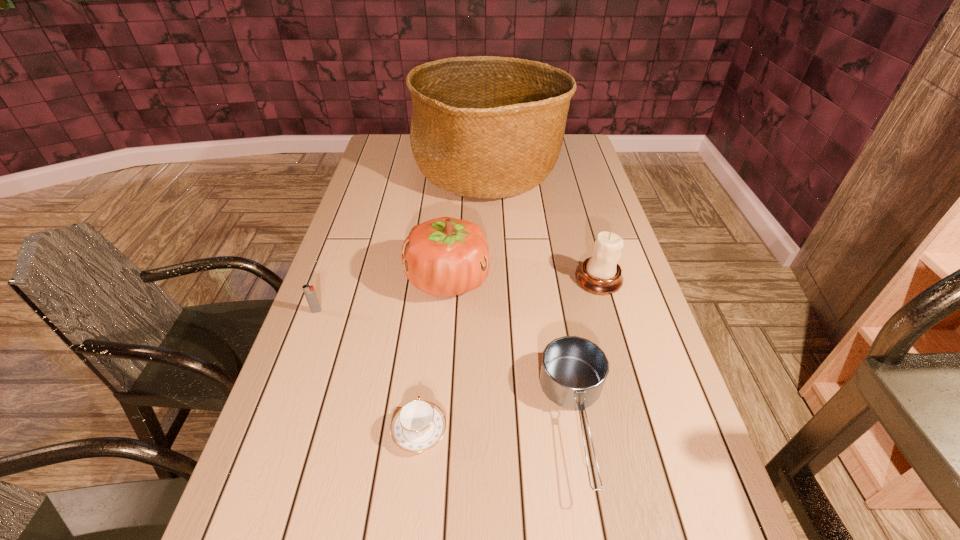
Where is `vacant area at the left edge of the desktop`? The height and width of the screenshot is (540, 960). vacant area at the left edge of the desktop is located at coordinates (365, 186).

Where is `vacant region at the right edge of the desktop`? This screenshot has height=540, width=960. vacant region at the right edge of the desktop is located at coordinates (563, 192).

At what (x,y) coordinates should I click in order to perform the action: click on free space at the far left corner of the desktop. Please return your answer as a coordinate pair (x, y). Looking at the image, I should click on (378, 148).

In the image, there is a desktop. Where is `vacant space at the far right corner`? The image size is (960, 540). vacant space at the far right corner is located at coordinates (566, 155).

The width and height of the screenshot is (960, 540). In order to click on empty location between the leftmost object and the shortest object in this screenshot , I will do `click(368, 370)`.

I want to click on vacant region between the teacup and the pumpkin, so click(434, 355).

The width and height of the screenshot is (960, 540). In order to click on empty space that is in between the igniter and the fourth shortest object in this screenshot , I will do `click(458, 295)`.

You are a GUI agent. You are given a task and a screenshot of the screen. Output one action in this format:
    pyautogui.click(x=<x>, y=<y>)
    Task: Click on the free space between the igniter and the tallest object
    
    Given the screenshot: What is the action you would take?
    pyautogui.click(x=402, y=242)

What are the coordinates of `vacant point located between the shortest object and the pumpkin` in the screenshot? It's located at (434, 355).

You are a GUI agent. You are given a task and a screenshot of the screen. Output one action in this format:
    pyautogui.click(x=<x>, y=<y>)
    Task: Click on the vacant space in between the saucepan and the leftmost object
    The height and width of the screenshot is (540, 960).
    Given the screenshot: What is the action you would take?
    pyautogui.click(x=446, y=366)